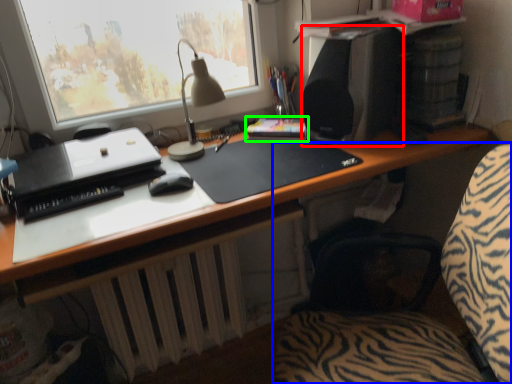
Question: Based on their relative distances, which object is nearer to loudspeaker (highlighted by a red box)? Choose from computer chair (highlighted by a blue box) and paperback book (highlighted by a green box).

Choices:
 (A) computer chair
 (B) paperback book

Answer: (B)